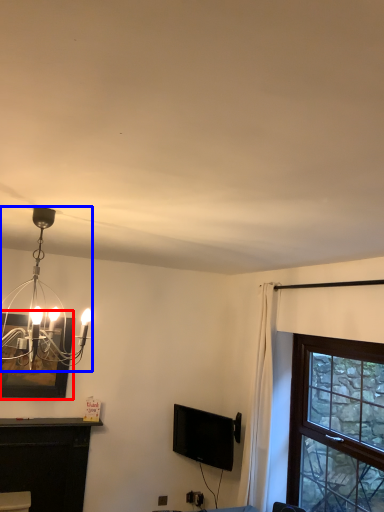
Question: Which of the following is the closest to the observer, picture frame (highlighted by a red box) or lamp (highlighted by a blue box)?

Choices:
 (A) picture frame
 (B) lamp

Answer: (B)